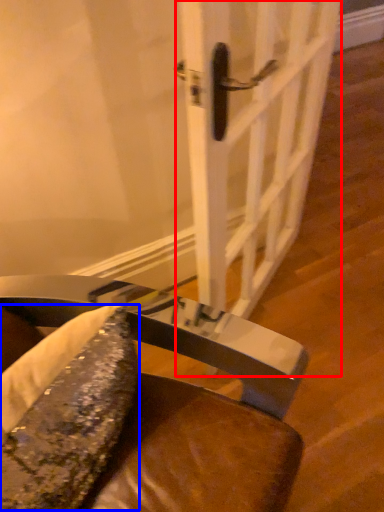
Question: Which point is closer to the camera, door (highlighted by a red box) or food (highlighted by a blue box)?

Choices:
 (A) door
 (B) food

Answer: (B)